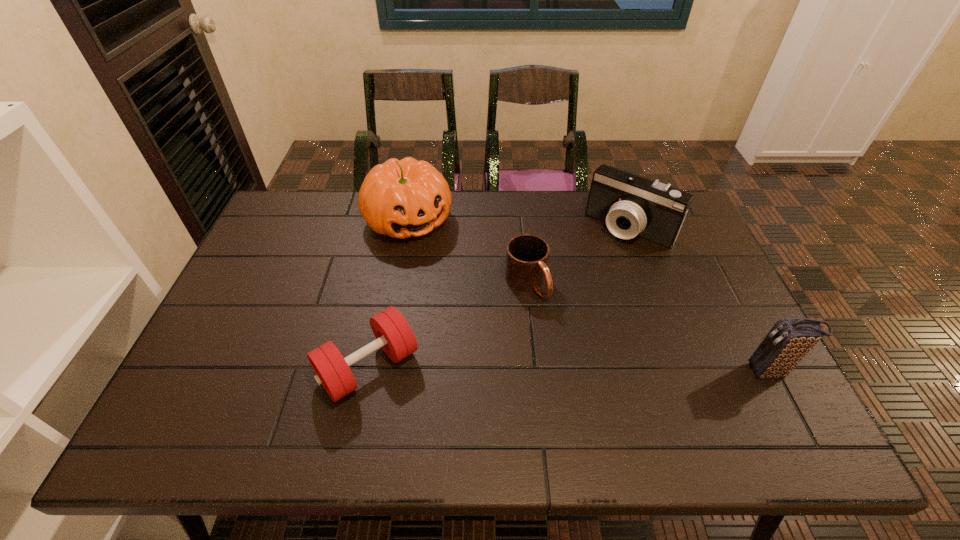
The width and height of the screenshot is (960, 540). Find the location of `free spot between the dumbbell and the clutch bag`. free spot between the dumbbell and the clutch bag is located at coordinates (569, 369).

Where is `free space between the pumpkin and the mug`? This screenshot has width=960, height=540. free space between the pumpkin and the mug is located at coordinates (468, 251).

Locate an element on the screen. The width and height of the screenshot is (960, 540). vacant space in between the third farthest object and the camcorder is located at coordinates pyautogui.click(x=578, y=255).

Image resolution: width=960 pixels, height=540 pixels. I want to click on vacant space in between the pumpkin and the camcorder, so click(x=518, y=223).

Identify which object is the second closest to the rightmost object. Please provide its 2D coordinates. Your answer should be formatted as a tuple, i.e. [(x, y)], where the tuple contains the x and y coordinates of a point satisfying the conditions above.

[(527, 255)]

Where is `object that can be found as the closest to the rightmost object`? This screenshot has height=540, width=960. object that can be found as the closest to the rightmost object is located at coordinates (631, 205).

The height and width of the screenshot is (540, 960). Find the location of `vacant space that satisfies the following two spatial constraints: 1. on the back side of the camcorder; 2. on the right side of the third nearest object`. vacant space that satisfies the following two spatial constraints: 1. on the back side of the camcorder; 2. on the right side of the third nearest object is located at coordinates (521, 227).

You are a GUI agent. You are given a task and a screenshot of the screen. Output one action in this format:
    pyautogui.click(x=<x>, y=<y>)
    Task: Click on the free location that satisfies the following two spatial constraints: 1. on the front side of the pumpkin; 2. with the zip open on the rightmost object
    The height and width of the screenshot is (540, 960).
    Given the screenshot: What is the action you would take?
    pyautogui.click(x=381, y=372)

At what (x,y) coordinates should I click in order to perform the action: click on free location that satisfies the following two spatial constraints: 1. on the front side of the rightmost object; 2. with the zip open on the fourth object from left to right. Please return your answer as a coordinate pair (x, y). Image resolution: width=960 pixels, height=540 pixels. Looking at the image, I should click on (682, 372).

You are a GUI agent. You are given a task and a screenshot of the screen. Output one action in this format:
    pyautogui.click(x=<x>, y=<y>)
    Task: Click on the free space in the image that satisfies the following two spatial constraints: 1. on the front side of the clutch bag; 2. with the zip open on the dumbbell
    
    Given the screenshot: What is the action you would take?
    (x=368, y=372)